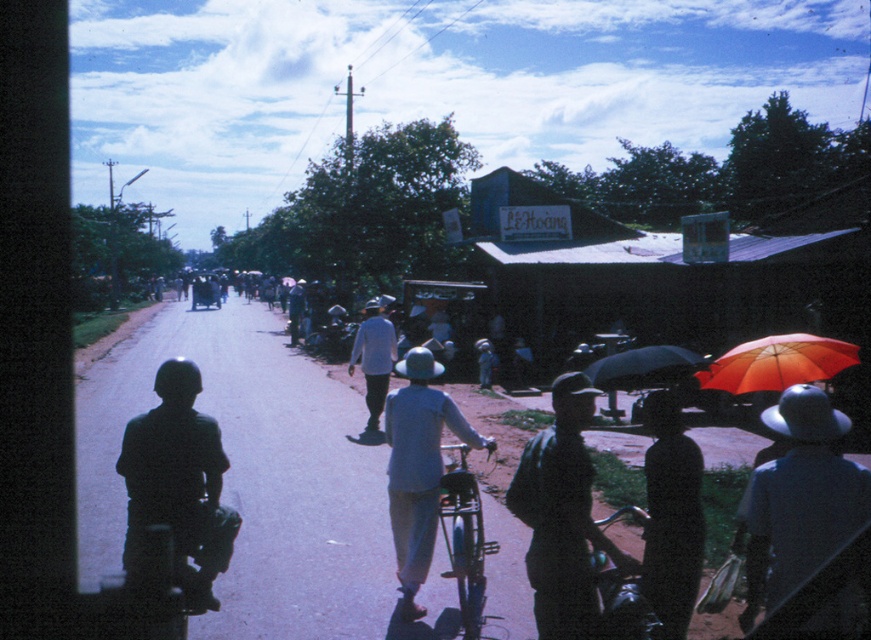
Question: Can you confirm if dark green helmet at center is positioned to the left of black matte hat at lower right?

Choices:
 (A) yes
 (B) no

Answer: (A)

Question: Among these points, which one is nearest to the camera?

Choices:
 (A) (127, 490)
 (B) (471, 554)

Answer: (A)

Question: Does dark green helmet at center lie behind shiny chrome motorcycle at lower right?

Choices:
 (A) yes
 (B) no

Answer: (A)

Question: Which of the following is the closest to the observer?

Choices:
 (A) coord(620,572)
 (B) coord(834,541)

Answer: (B)

Question: Does dark gray uniform at center have a smaller size compared to light blue fabric hat at center?

Choices:
 (A) yes
 (B) no

Answer: (B)

Question: Among these objects, which one is nearest to the camera?

Choices:
 (A) dark gray uniform at center
 (B) light blue fabric hat at center
 (C) black matte hat at lower right

Answer: (C)